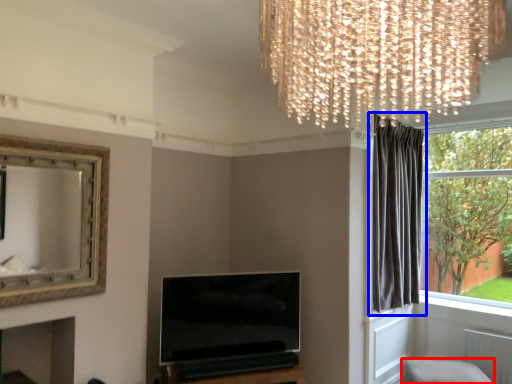
Question: Which of the following is the farthest to the observer, furniture (highlighted by a red box) or curtain (highlighted by a blue box)?

Choices:
 (A) furniture
 (B) curtain

Answer: (B)